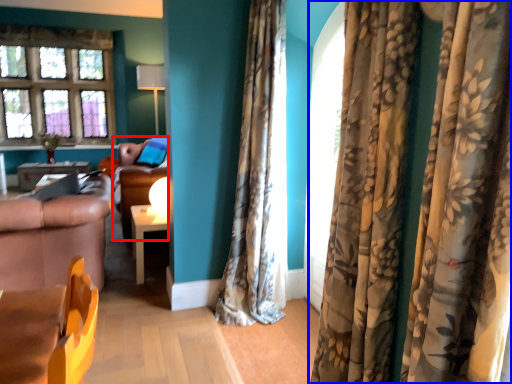
Question: Which point is closer to the camera, couch (highlighted by a red box) or curtain (highlighted by a blue box)?

Choices:
 (A) couch
 (B) curtain

Answer: (B)